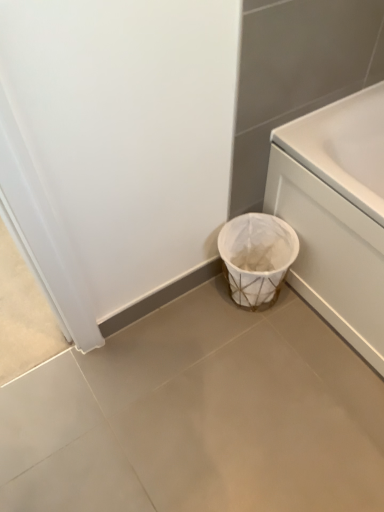
Measure the distance between point (330, 218) and camera.

Point (330, 218) and camera are 3.83 feet apart.

What are the coordinates of `white glossy bathtub at right` in the screenshot? It's located at (336, 213).

Is white woven basket at lower center oriented away from white glossy bathtub at right?

Yes, white woven basket at lower center is positioned with its back facing white glossy bathtub at right.

Considering the relative positions of white woven basket at lower center and white glossy bathtub at right in the image provided, is white woven basket at lower center to the left or to the right of white glossy bathtub at right?

From the image, it's evident that white woven basket at lower center is to the left of white glossy bathtub at right.

From a real-world perspective, is white woven basket at lower center positioned over white glossy bathtub at right based on gravity?

Actually, white woven basket at lower center is physically below white glossy bathtub at right in the real world.

Considering the sizes of objects white glossy bathtub at right and white woven basket at lower center in the image provided, who is shorter, white glossy bathtub at right or white woven basket at lower center?

With less height is white woven basket at lower center.

How distant is white glossy bathtub at right from white woven basket at lower center?

white glossy bathtub at right is 7.34 inches away from white woven basket at lower center.

Is white glossy bathtub at right positioned before white woven basket at lower center?

That is True.

From the image's perspective, is white glossy bathtub at right located beneath white woven basket at lower center?

No.

From the image's perspective, which one is positioned higher, white glossy bathtub at right or white matte trash can at lower right?

white glossy bathtub at right appears higher in the image.

Can you tell me how much white glossy bathtub at right and white matte trash can at lower right differ in facing direction?

The angle between the facing direction of white glossy bathtub at right and the facing direction of white matte trash can at lower right is 90.5 degrees.

Is point (323, 127) closer to camera compared to point (355, 452)?

That is False.

This screenshot has width=384, height=512. In the image, there is a white matte trash can at lower right. In order to click on bath above it (from the image's perspective) in this screenshot , I will do `click(336, 213)`.

Considering the positions of points (197, 435) and (367, 104), is point (197, 435) farther from camera compared to point (367, 104)?

No, (197, 435) is in front of (367, 104).

Would you say white glossy bathtub at right is part of white matte trash can at lower right's contents?

No, white matte trash can at lower right does not contain white glossy bathtub at right.

From a real-world perspective, is white matte trash can at lower right physically below white woven basket at lower center?

Yes, from a real-world perspective, white matte trash can at lower right is beneath white woven basket at lower center.

Which is behind, white matte trash can at lower right or white woven basket at lower center?

Positioned behind is white woven basket at lower center.

At what (x,y) coordinates should I click in order to perform the action: click on concrete that appears in front of the white woven basket at lower center. Please return your answer as a coordinate pair (x, y). The width and height of the screenshot is (384, 512). Looking at the image, I should click on (199, 416).

How much distance is there between white woven basket at lower center and white matte trash can at lower right?

The distance of white woven basket at lower center from white matte trash can at lower right is 37.08 centimeters.

Does white woven basket at lower center lie behind white matte trash can at lower right?

Yes, white woven basket at lower center is behind white matte trash can at lower right.

From the image's perspective, between white woven basket at lower center and white matte trash can at lower right, which one is located above?

white woven basket at lower center.

From a real-world perspective, is white woven basket at lower center above or below white matte trash can at lower right?

In terms of real-world spatial position, white woven basket at lower center is above white matte trash can at lower right.

Locate an element on the screen. This screenshot has height=512, width=384. bath above the white woven basket at lower center (from the image's perspective) is located at coordinates (336, 213).

In order to click on waste container below the white glossy bathtub at right (from a real-world perspective) in this screenshot , I will do coord(257,257).

Looking at the image, which one is located further to white matte trash can at lower right, white woven basket at lower center or white glossy bathtub at right?

white glossy bathtub at right.

When comparing their distances from white glossy bathtub at right, does white woven basket at lower center or white matte trash can at lower right seem closer?

Based on the image, white woven basket at lower center appears to be nearer to white glossy bathtub at right.

From the image, which object appears to be nearer to white glossy bathtub at right, white matte trash can at lower right or white woven basket at lower center?

white woven basket at lower center is positioned closer to the anchor white glossy bathtub at right.

From the image, which object appears to be farther from white woven basket at lower center, white glossy bathtub at right or white matte trash can at lower right?

white matte trash can at lower right is further to white woven basket at lower center.

When comparing their distances from white matte trash can at lower right, does white glossy bathtub at right or white woven basket at lower center seem further?

white glossy bathtub at right lies further to white matte trash can at lower right than the other object.

Estimate the real-world distances between objects in this image. Which object is further from white woven basket at lower center, white matte trash can at lower right or white glossy bathtub at right?

white matte trash can at lower right is positioned further to the anchor white woven basket at lower center.

You are a GUI agent. You are given a task and a screenshot of the screen. Output one action in this format:
    pyautogui.click(x=<x>, y=<y>)
    Task: Click on the waste container between white matte trash can at lower right and white glossy bathtub at right in the horizontal direction
    The image size is (384, 512).
    Given the screenshot: What is the action you would take?
    pyautogui.click(x=257, y=257)